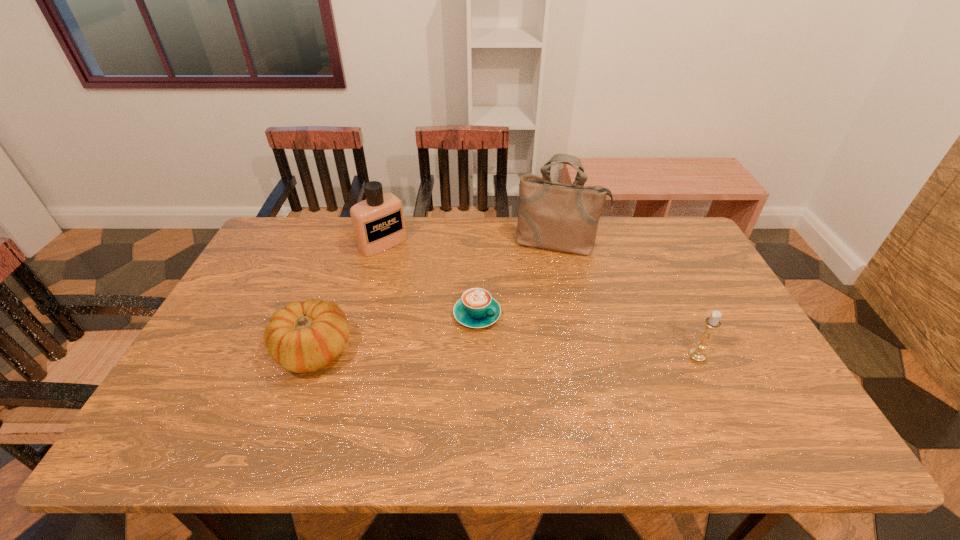
Identify the location of the second shortest object. (305, 337).

Locate an element on the screen. the third tallest object is located at coordinates (712, 323).

Image resolution: width=960 pixels, height=540 pixels. In order to click on the rightmost object in this screenshot , I will do (712, 323).

Where is `the tallest object`? the tallest object is located at coordinates (562, 217).

Locate an element on the screen. This screenshot has width=960, height=540. the second object from right to left is located at coordinates (562, 217).

The height and width of the screenshot is (540, 960). What are the coordinates of `the shortest object` in the screenshot? It's located at (476, 309).

The height and width of the screenshot is (540, 960). I want to click on the third object from right to left, so click(476, 309).

This screenshot has width=960, height=540. Identify the location of perfume. (378, 222).

Find the location of a particular element. vacant space located on the back of the fourth tallest object is located at coordinates (353, 241).

The height and width of the screenshot is (540, 960). I want to click on vacant region located 0.320m on the back of the candle holder, so click(658, 271).